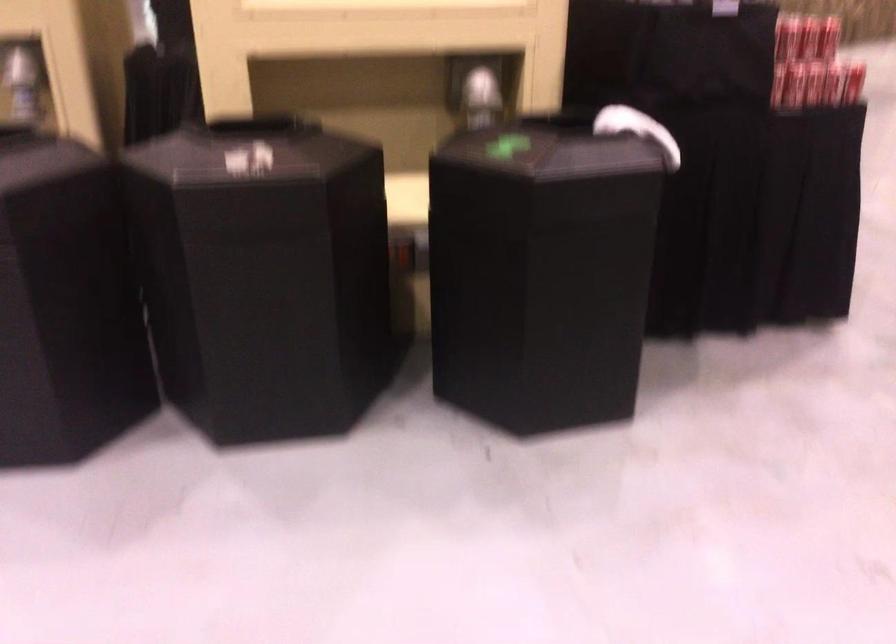
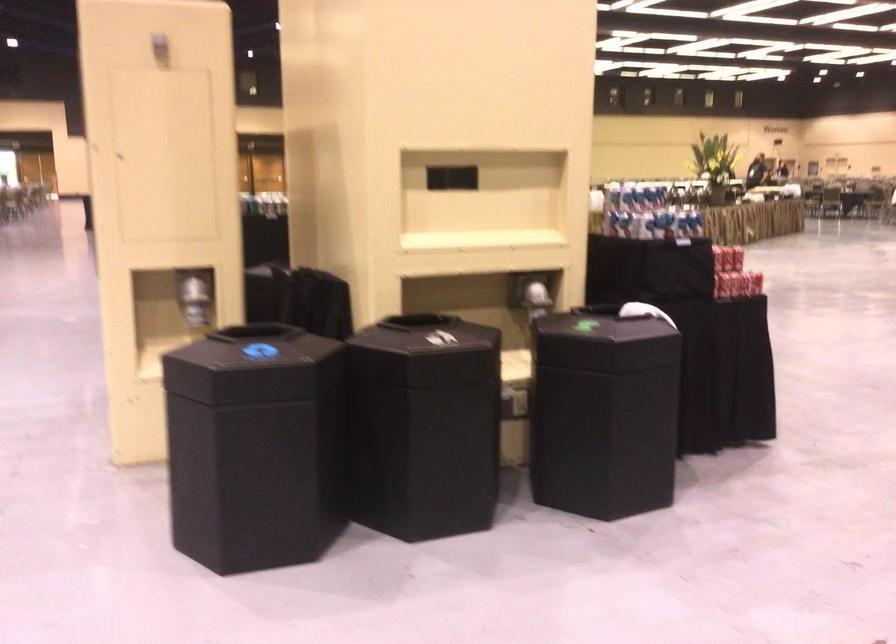
Find the pixel in the second image that matches (x=475, y=93) in the first image.

(536, 299)